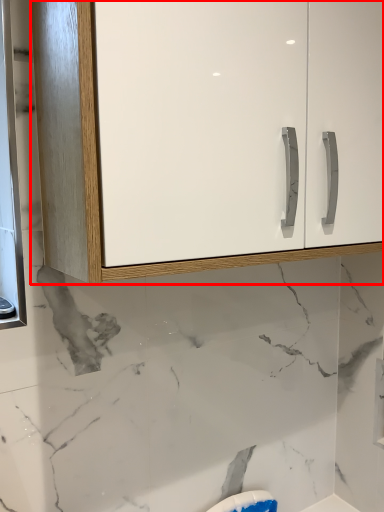
Question: From the image's perspective, where is cabinetry (annotated by the red box) located in relation to medicine cabinet in the image?

Choices:
 (A) above
 (B) below

Answer: (A)